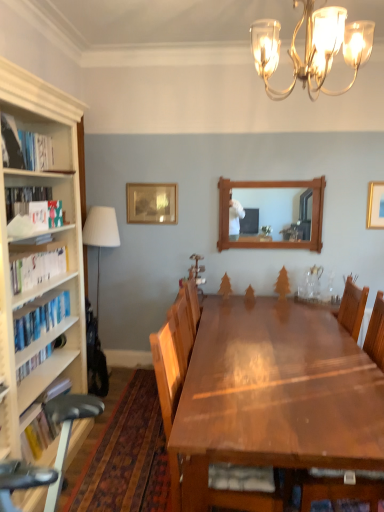
You are a GUI agent. You are given a task and a screenshot of the screen. Output one action in this format:
    pyautogui.click(x=<x>, y=<y>)
    Task: Click on the empty space that is ontop of wooden frame mirror at center (from a real-world perspective)
    
    Given the screenshot: What is the action you would take?
    pyautogui.click(x=284, y=173)